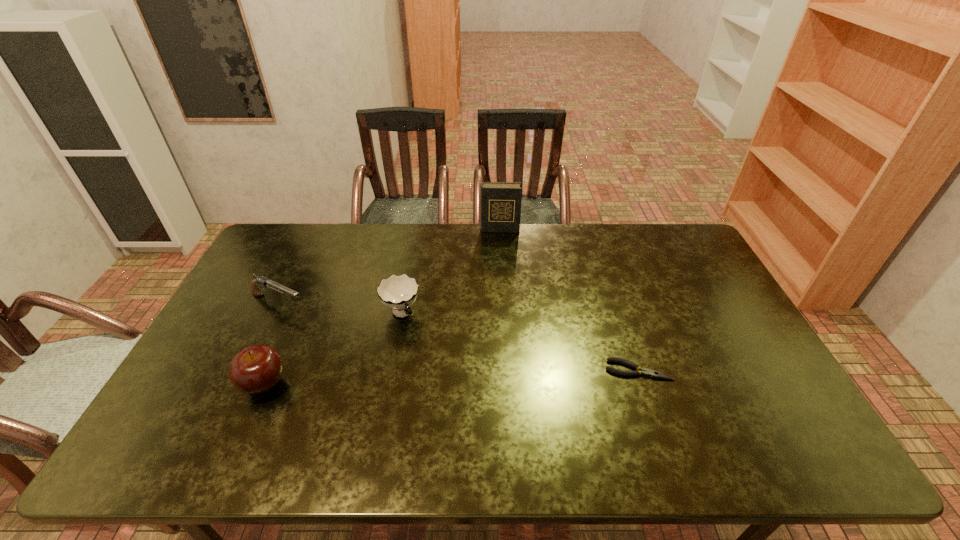
Locate an element on the screen. The height and width of the screenshot is (540, 960). apple located in the left edge section of the desktop is located at coordinates (256, 369).

This screenshot has height=540, width=960. What are the coordinates of `gun situated at the left edge` in the screenshot? It's located at (262, 282).

Image resolution: width=960 pixels, height=540 pixels. What are the coordinates of `object that is at the near left corner` in the screenshot? It's located at (256, 369).

Locate an element on the screen. free space at the far edge of the desktop is located at coordinates (582, 227).

In the image, there is a desktop. Where is `vacant space at the near edge`? Image resolution: width=960 pixels, height=540 pixels. vacant space at the near edge is located at coordinates (x=244, y=400).

I want to click on free point at the left edge, so click(x=214, y=338).

This screenshot has width=960, height=540. I want to click on vacant area at the right edge, so click(x=728, y=376).

I want to click on vacant space at the far left corner, so click(284, 225).

Image resolution: width=960 pixels, height=540 pixels. Identify the location of vacant space at the near left corner of the desktop. (220, 422).

In the image, there is a desktop. Where is `vacant space at the far right corner`? vacant space at the far right corner is located at coordinates (662, 230).